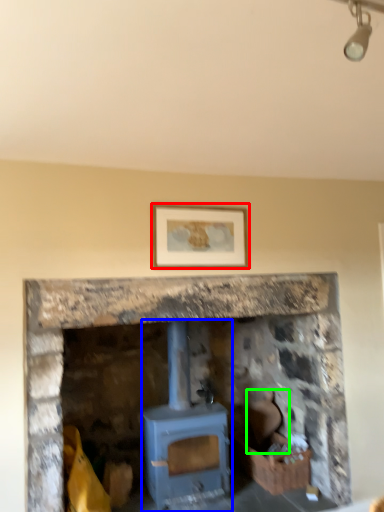
Question: Which object is positioned farthest from picture frame (highlighted by a red box)? Select from wood burning stove (highlighted by a blue box) and chair (highlighted by a green box).

Choices:
 (A) wood burning stove
 (B) chair

Answer: (B)